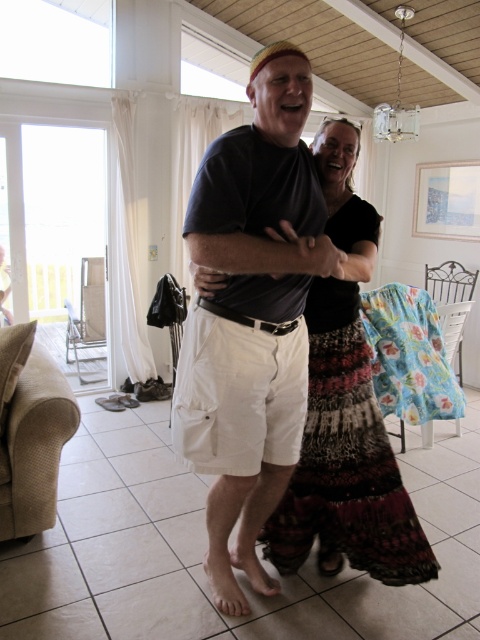
Between matte black t-shirt at center and multicolored woven skirt at center, which one is positioned higher?

matte black t-shirt at center is above.

Who is more distant from viewer, (343,324) or (282,513)?

Point (282,513)

Image resolution: width=480 pixels, height=640 pixels. I want to click on matte black t-shirt at center, so click(342, 413).